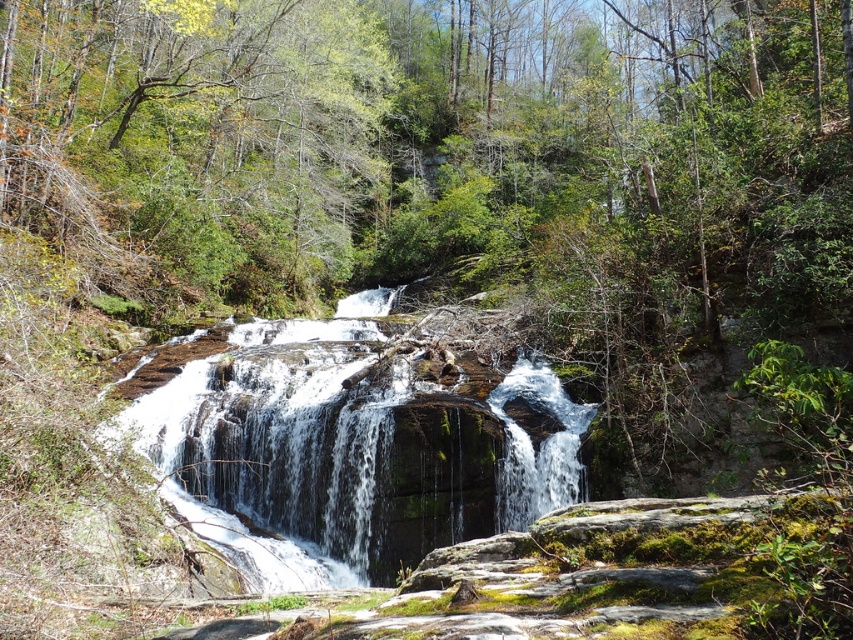
From the picture: You are standing at the center of the forest looking towards the waterfall. Where is the green leafy tree at upper left located in relation to your position?

The green leafy tree at upper left is located at the upper left direction from your position, at coordinates approximately 0.223 on the x and 0.227 on the y axis.

You are a hiker trying to navigate through the forest. You see the green leafy tree at upper left and the green mossy rock at center. Which object is taller and would cast a longer shadow during midday?

The green leafy tree at upper left is taller than the green mossy rock at center, so it would cast a longer shadow during midday.